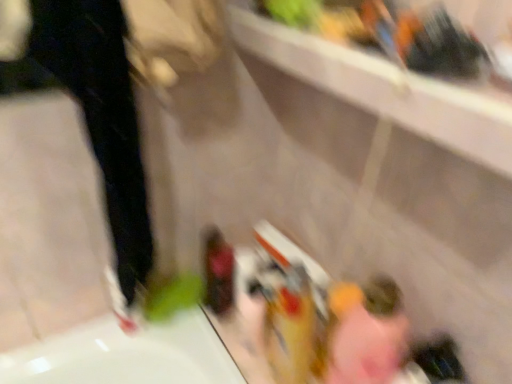
Describe the element at coordinates (370, 337) in the screenshot. I see `pink fabric at lower right` at that location.

This screenshot has width=512, height=384. I want to click on pink fabric at lower right, so pyautogui.click(x=370, y=337).

From a real-world perspective, which is physically above, pink fabric at lower right or black matte pants at left?

black matte pants at left, from a real-world perspective.

Is pink fabric at lower right looking in the opposite direction of black matte pants at left?

No, pink fabric at lower right is not facing the opposite direction of black matte pants at left.

Is pink fabric at lower right in front of black matte pants at left?

That is False.

Can you confirm if black matte pants at left is wider than pink fabric at lower right?

In fact, black matte pants at left might be narrower than pink fabric at lower right.

Is black matte pants at left not inside pink fabric at lower right?

Yes.

Visually, is black matte pants at left positioned to the left or to the right of pink fabric at lower right?

black matte pants at left is positioned on pink fabric at lower right's left side.

Which of these two, black matte pants at left or pink fabric at lower right, is bigger?

black matte pants at left.

Is black matte pants at left oriented away from white matte shoe at lower left?

No, white matte shoe at lower left is not at the back of black matte pants at left.

Who is bigger, black matte pants at left or white matte shoe at lower left?

Bigger between the two is black matte pants at left.

How different are the orientations of black matte pants at left and white matte shoe at lower left in degrees?

black matte pants at left and white matte shoe at lower left are facing 2.11 degrees away from each other.

Does point (129, 309) appear closer or farther from the camera than point (72, 2)?

Point (129, 309) appears to be farther away from the viewer than point (72, 2).

Is white matte shoe at lower left aimed at black matte pants at left?

No, white matte shoe at lower left is not aimed at black matte pants at left.

Consider the image. From a real-world perspective, which object rests below the other?

white matte shoe at lower left is physically lower.

Is pink fabric at lower right at the left side of white matte shoe at lower left?

No, pink fabric at lower right is not to the left of white matte shoe at lower left.

Which of these two, pink fabric at lower right or white matte shoe at lower left, is bigger?

Bigger between the two is pink fabric at lower right.

Are pink fabric at lower right and white matte shoe at lower left located far from each other?

No, pink fabric at lower right is in close proximity to white matte shoe at lower left.

Choose the correct answer: Is pink fabric at lower right inside white matte shoe at lower left or outside it?

pink fabric at lower right lies outside white matte shoe at lower left.

Is white matte shoe at lower left closer to camera compared to pink fabric at lower right?

No, the depth of white matte shoe at lower left is greater than that of pink fabric at lower right.

Is white matte shoe at lower left oriented towards pink fabric at lower right?

No.

Does white matte shoe at lower left have a lesser width compared to pink fabric at lower right?

Yes, white matte shoe at lower left is thinner than pink fabric at lower right.

How many degrees apart are the facing directions of white matte shoe at lower left and pink fabric at lower right?

The angular difference between white matte shoe at lower left and pink fabric at lower right is 91.8 degrees.

Find the location of `woman below the black matte pants at left (from the image's perspective)`. woman below the black matte pants at left (from the image's perspective) is located at coordinates (370, 337).

At what (x,y) coordinates should I click in order to perform the action: click on pants located above the pink fabric at lower right (from a real-world perspective). Please return your answer as a coordinate pair (x, y). This screenshot has height=384, width=512. Looking at the image, I should click on (102, 115).

Based on their spatial positions, is white matte shoe at lower left or black matte pants at left further from pink fabric at lower right?

black matte pants at left is positioned further to the anchor pink fabric at lower right.

Estimate the real-world distances between objects in this image. Which object is closer to white matte shoe at lower left, black matte pants at left or pink fabric at lower right?

black matte pants at left lies closer to white matte shoe at lower left than the other object.

From the image, which object appears to be farther from pink fabric at lower right, black matte pants at left or white matte shoe at lower left?

Based on the image, black matte pants at left appears to be further to pink fabric at lower right.

From the image, which object appears to be farther from white matte shoe at lower left, pink fabric at lower right or black matte pants at left?

pink fabric at lower right is further to white matte shoe at lower left.

Estimate the real-world distances between objects in this image. Which object is closer to black matte pants at left, pink fabric at lower right or white matte shoe at lower left?

Among the two, white matte shoe at lower left is located nearer to black matte pants at left.

Looking at the image, which one is located further to black matte pants at left, white matte shoe at lower left or pink fabric at lower right?

Based on the image, pink fabric at lower right appears to be further to black matte pants at left.

Where is `pants situated between white matte shoe at lower left and pink fabric at lower right from left to right`? pants situated between white matte shoe at lower left and pink fabric at lower right from left to right is located at coordinates (102, 115).